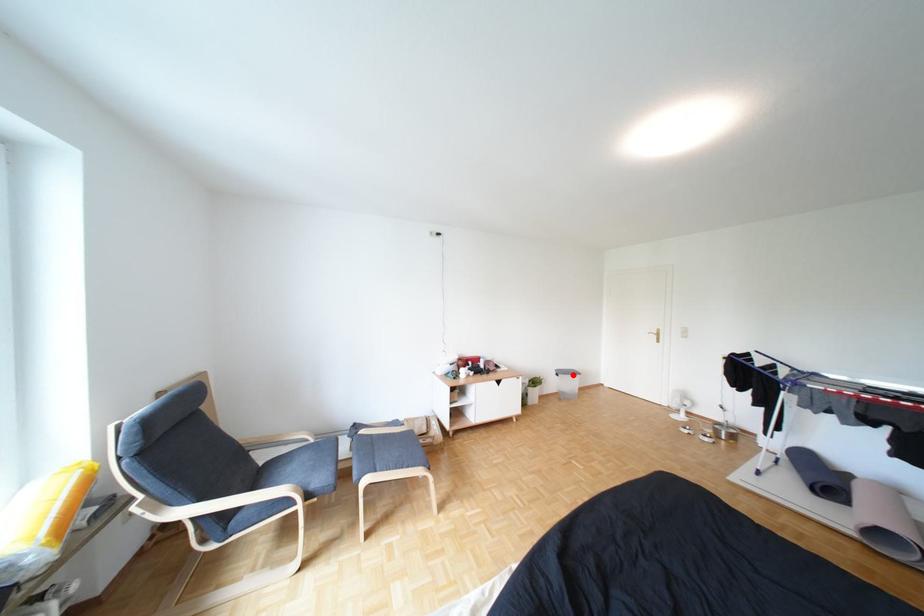
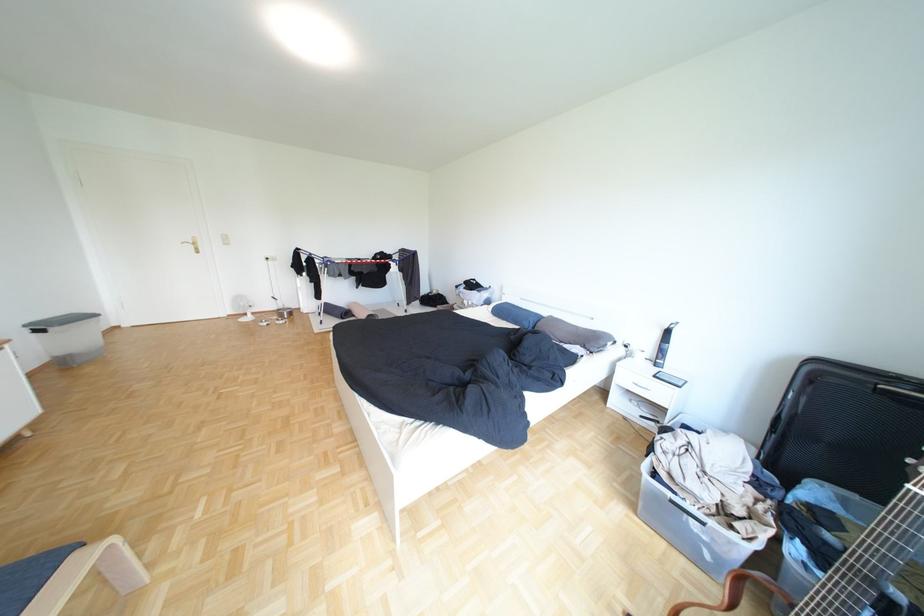
The point at the highlighted location is marked in the first image. Where is the corresponding point in the second image?

(55, 331)